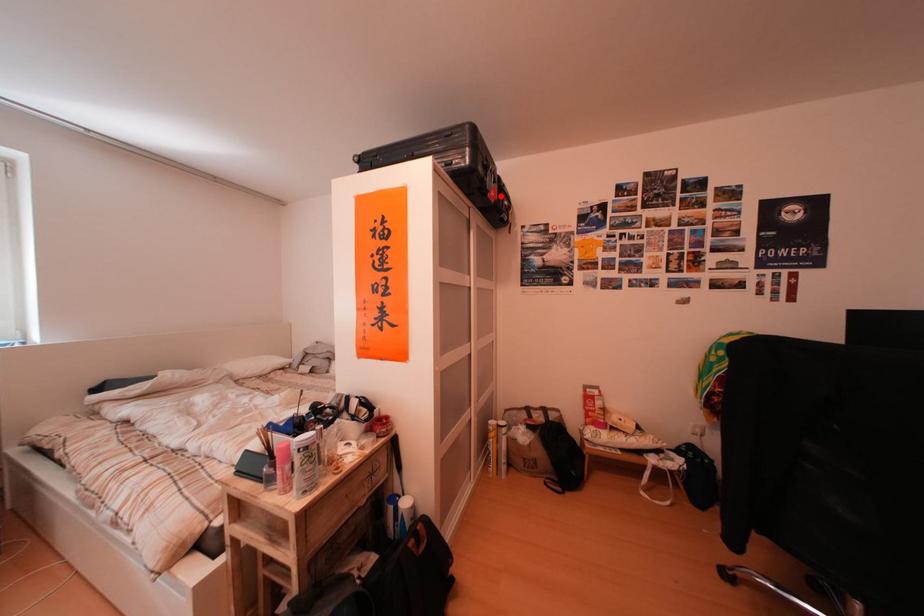
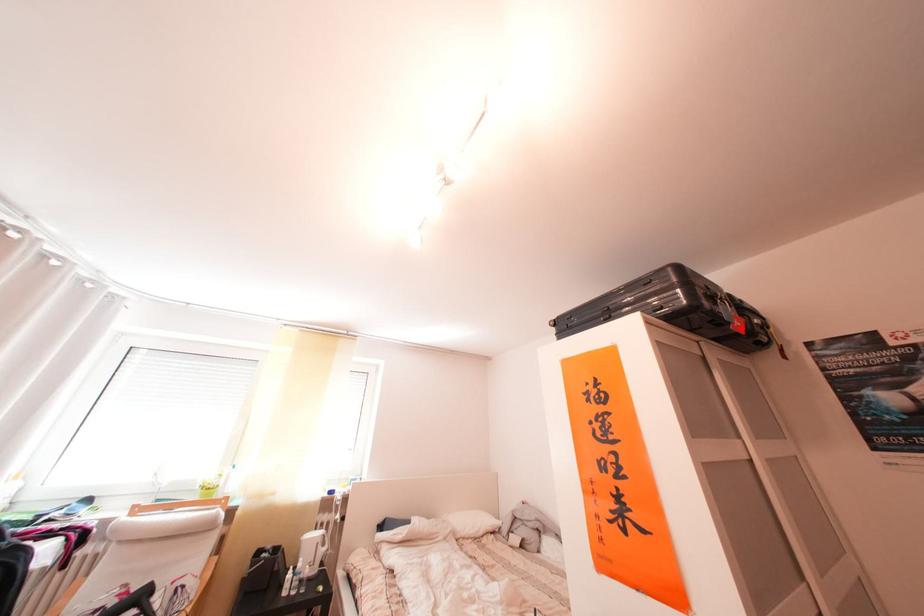
I am providing you with two images of the same scene from different viewpoints. A red point is marked on the first image and another point is marked on the second image. Are the points marked in image1 and image2 representing the same 3D position?

Yes